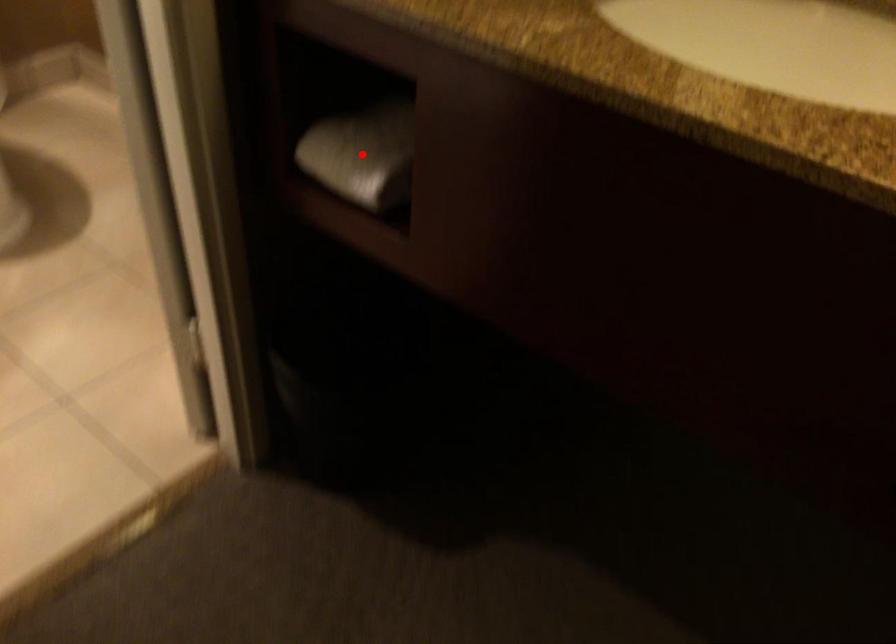
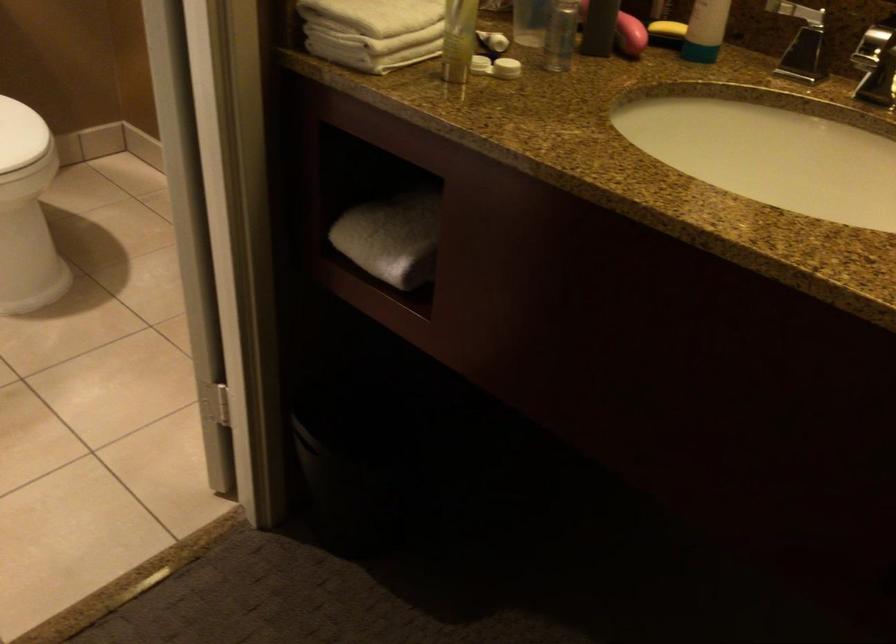
The point at the highlighted location is marked in the first image. Where is the corresponding point in the second image?

(392, 238)